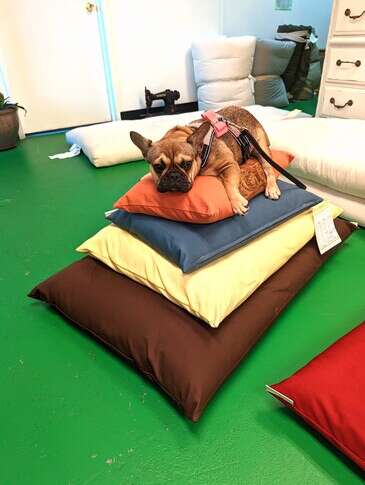
Where is `pet bed`? This screenshot has height=485, width=365. pet bed is located at coordinates (x=334, y=387), (x=226, y=274), (x=207, y=244), (x=183, y=352), (x=205, y=200), (x=208, y=70), (x=361, y=145), (x=344, y=210), (x=266, y=57), (x=297, y=65).